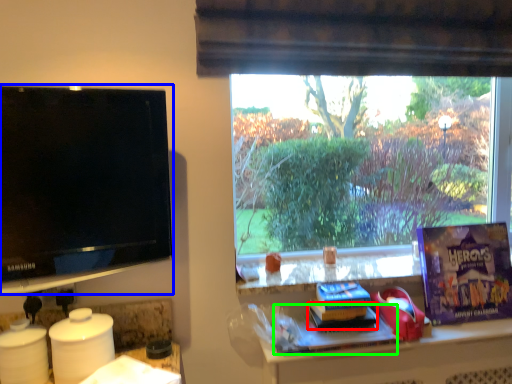
Question: Estimate the real-world distances between objects in this image. Which object is farther from book (highlighted by a red box), television (highlighted by a blue box) or book (highlighted by a green box)?

Choices:
 (A) television
 (B) book

Answer: (A)